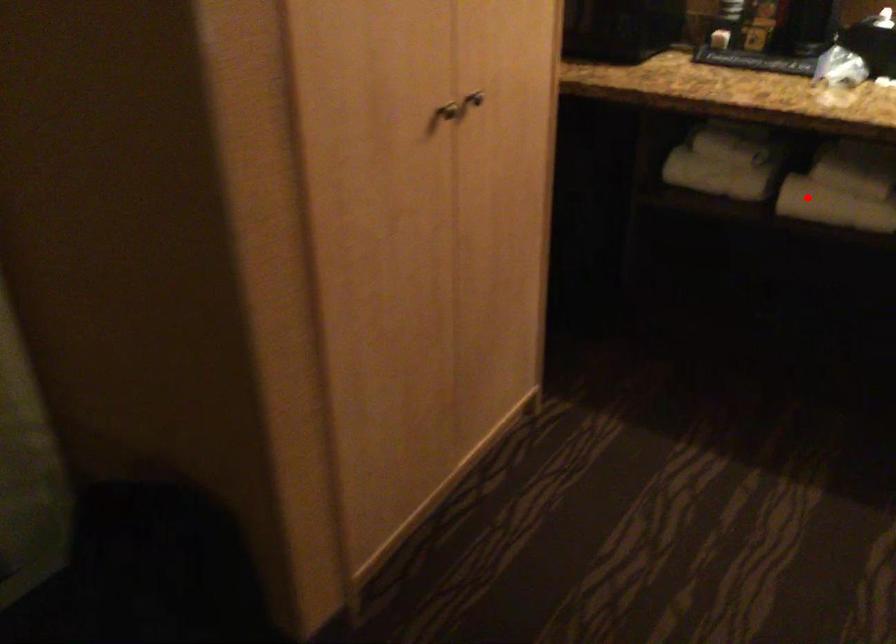
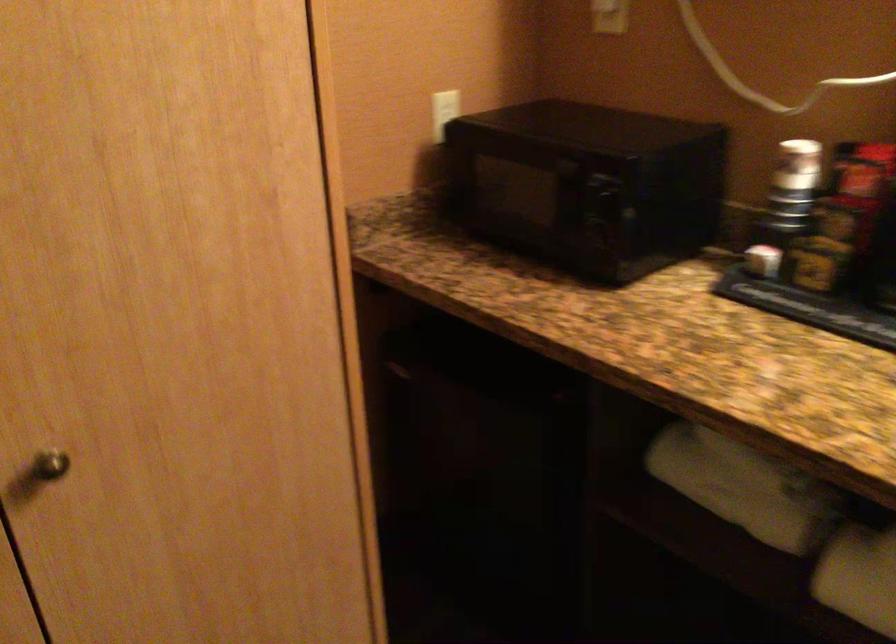
Question: I am providing you with two images of the same scene from different viewpoints. Image1 has a red point marked. In image2, the corresponding 3D location appears at what relative position? Reply with the corresponding letter.

Choices:
 (A) Closer
 (B) Farther

Answer: (A)